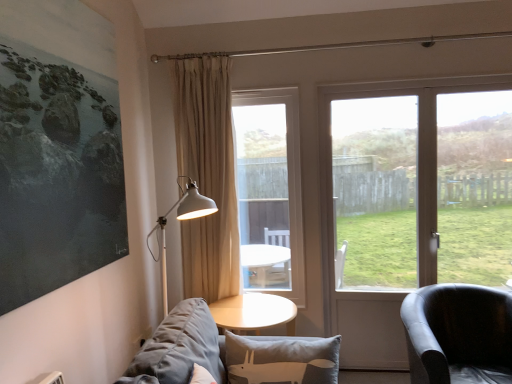
Question: Does transparent glass screen door at right turn towards clear glass window at center, the 1th window in the left-to-right sequence?

Choices:
 (A) no
 (B) yes

Answer: (A)

Question: From a real-world perspective, is transparent glass screen door at right positioned over clear glass window at center, the 1th window in the left-to-right sequence, based on gravity?

Choices:
 (A) no
 (B) yes

Answer: (A)

Question: Considering the relative sizes of transparent glass screen door at right and clear glass window at center, the 1th window in the left-to-right sequence, in the image provided, is transparent glass screen door at right smaller than clear glass window at center, the 1th window in the left-to-right sequence,?

Choices:
 (A) no
 (B) yes

Answer: (B)

Question: Would you say transparent glass screen door at right is a long distance from clear glass window at center, the 1th window in the left-to-right sequence?

Choices:
 (A) yes
 (B) no

Answer: (A)

Question: From a real-world perspective, does transparent glass screen door at right sit lower than clear glass window at center, which appears as the 2th window when viewed from the right?

Choices:
 (A) no
 (B) yes

Answer: (B)

Question: Is point (412, 223) closer or farther from the camera than point (249, 372)?

Choices:
 (A) farther
 (B) closer

Answer: (A)

Question: Considering the positions of transparent glass screen door at right and gray fabric couch at lower left in the image, is transparent glass screen door at right taller or shorter than gray fabric couch at lower left?

Choices:
 (A) tall
 (B) short

Answer: (A)

Question: Is transparent glass screen door at right in front of or behind gray fabric couch at lower left in the image?

Choices:
 (A) front
 (B) behind

Answer: (B)

Question: From the image's perspective, is transparent glass screen door at right located above or below gray fabric couch at lower left?

Choices:
 (A) above
 (B) below

Answer: (A)

Question: Is point pos(399,296) closer or farther from the camera than point pos(206,110)?

Choices:
 (A) closer
 (B) farther

Answer: (B)

Question: Is transparent glass screen door at right bigger or smaller than beige fabric curtain at center?

Choices:
 (A) small
 (B) big

Answer: (A)

Question: Considering the positions of transparent glass screen door at right and beige fabric curtain at center in the image, is transparent glass screen door at right wider or thinner than beige fabric curtain at center?

Choices:
 (A) thin
 (B) wide

Answer: (A)

Question: From the image's perspective, is transparent glass screen door at right positioned above or below beige fabric curtain at center?

Choices:
 (A) below
 (B) above

Answer: (A)

Question: Is point (503, 365) positioned closer to the camera than point (359, 177)?

Choices:
 (A) closer
 (B) farther

Answer: (A)

Question: Is black leather armchair at right spatially inside transparent glass screen door at right, or outside of it?

Choices:
 (A) outside
 (B) inside

Answer: (A)